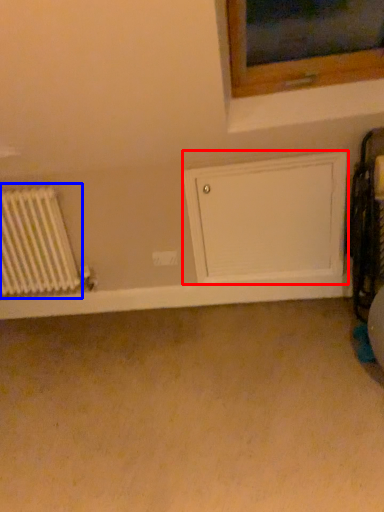
Question: Which point is further to the camera, wide (highlighted by a red box) or radiator (highlighted by a blue box)?

Choices:
 (A) wide
 (B) radiator

Answer: (B)